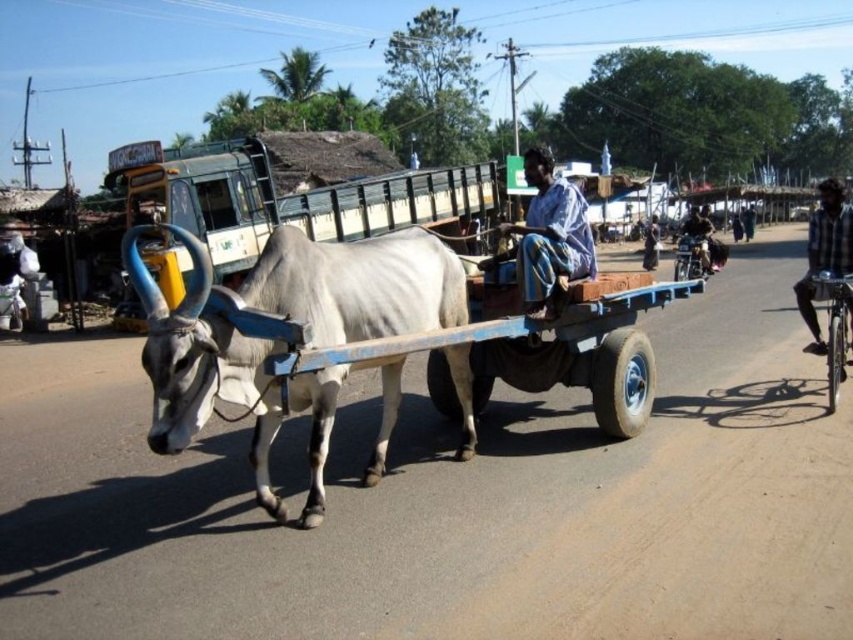
Can you confirm if blue fabric shirt at center is wider than dark blue fabric at center?

In fact, blue fabric shirt at center might be narrower than dark blue fabric at center.

Locate an element on the screen. This screenshot has height=640, width=853. blue fabric shirt at center is located at coordinates (548, 237).

Which is below, white matte bull at center or dark blue plaid shirt at right?

white matte bull at center is below.

Does point (169, 356) lie behind point (827, 259)?

No, it is not.

This screenshot has height=640, width=853. What are the coordinates of `white matte bull at center` in the screenshot? It's located at (357, 284).

Consider the image. Can you confirm if blue fabric shirt at center is shorter than dark blue plaid shirt at right?

Yes.

Does blue fabric shirt at center come behind dark blue plaid shirt at right?

That is False.

The height and width of the screenshot is (640, 853). Find the location of `blue fabric shirt at center`. blue fabric shirt at center is located at coordinates (548, 237).

The width and height of the screenshot is (853, 640). I want to click on blue fabric shirt at center, so click(x=548, y=237).